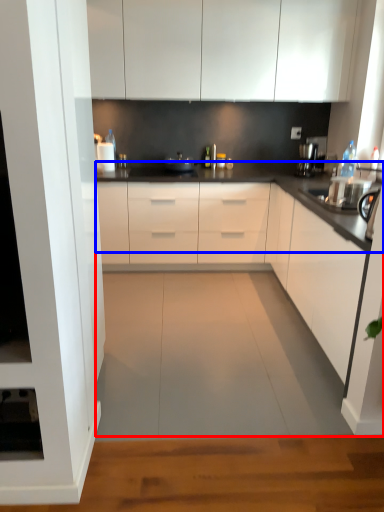
Question: Among these objects, which one is nearest to the camera, countertop (highlighted by a red box) or countertop (highlighted by a blue box)?

Choices:
 (A) countertop
 (B) countertop

Answer: (A)